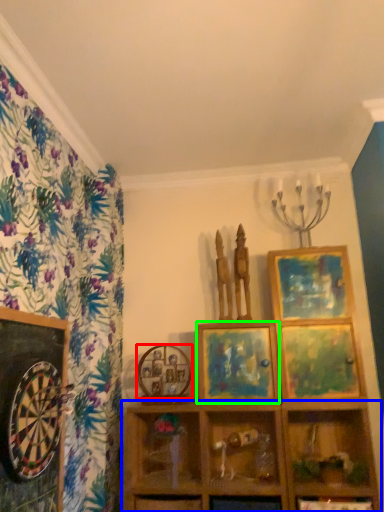
Question: Considering the real-world distances, which object is closest to picture frame (highlighted by a red box)? shelf (highlighted by a blue box) or picture frame (highlighted by a green box).

Choices:
 (A) shelf
 (B) picture frame

Answer: (B)